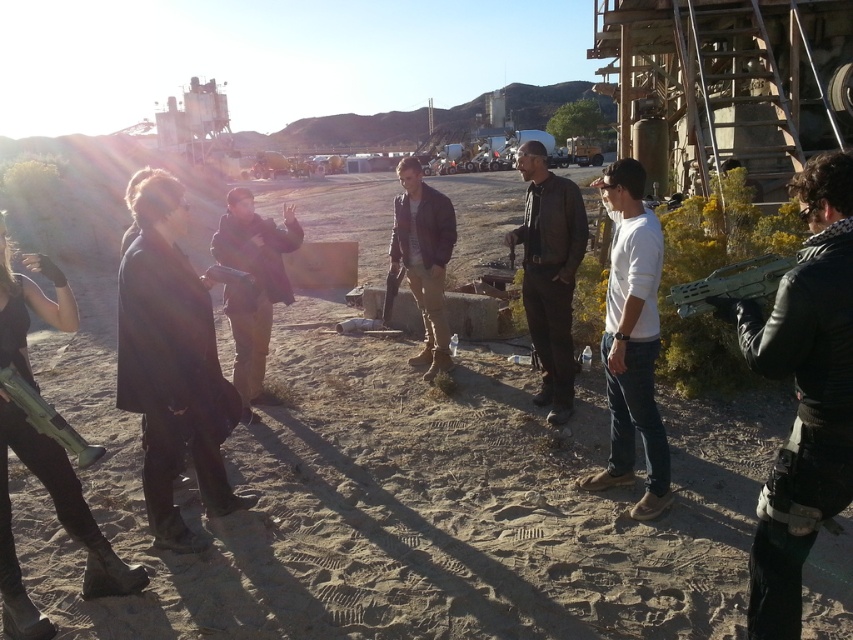
You are a photographer standing at the edge of the brown sandy dirt field at center. You want to place a tripod exactly at the center of the field. What are the coordinates where you should place it?

The coordinates for the center of the brown sandy dirt field at center are at point (402, 500).

You are standing in the desert scene and want to place a small flag exactly halfway between point (212,420) and point (242,340). Since you can only place the flag at one of these points, which point should you choose to be closer to the desired halfway position?

Point (212,420) is closer to the camera than point (242,340). Therefore, placing the flag at point (212,420) would be closer to the halfway position between the two points because it is nearer to the observer, making it the better choice.

You are a photographer standing at the camera position. You want to adjust the focus to capture the dark gray coat at center clearly. What is the minimum distance you need to move the focus ring to ensure the coat is in focus?

The dark gray coat at center is 3.51 meters away from the camera. To ensure it is in focus, adjust the focus ring to the 3.51 meter mark.